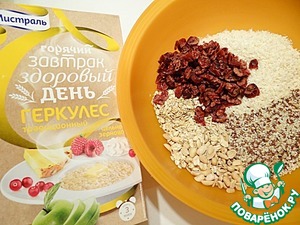
Find the location of a particular element. The image size is (300, 225). bowl is located at coordinates (216, 18).